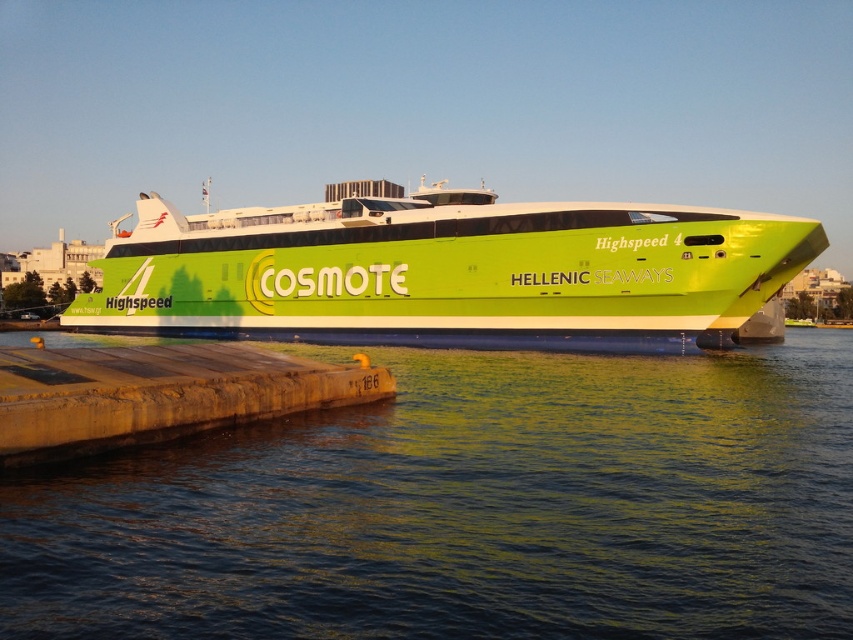
This screenshot has width=853, height=640. Describe the element at coordinates (469, 508) in the screenshot. I see `green reflective water at lower center` at that location.

Is point (131, 460) positioned in front of point (56, 442)?

No.

Is point (741, 484) positioned after point (363, 372)?

No, (741, 484) is in front of (363, 372).

The width and height of the screenshot is (853, 640). In order to click on green reflective water at lower center in this screenshot , I will do [469, 508].

Is green reflective water at lower center shorter than green matte/clear glass ferry at center?

Indeed, green reflective water at lower center has a lesser height compared to green matte/clear glass ferry at center.

Describe the element at coordinates (469, 508) in the screenshot. I see `green reflective water at lower center` at that location.

The height and width of the screenshot is (640, 853). In order to click on green reflective water at lower center in this screenshot , I will do `click(469, 508)`.

Is green matte/clear glass ferry at center below wooden dock at lower left?

Actually, green matte/clear glass ferry at center is above wooden dock at lower left.

Is green matte/clear glass ferry at center to the right of wooden dock at lower left from the viewer's perspective?

Incorrect, green matte/clear glass ferry at center is not on the right side of wooden dock at lower left.

Is point (602, 236) positioned in front of point (171, 369)?

No, it is not.

The width and height of the screenshot is (853, 640). Find the location of `green matte/clear glass ferry at center`. green matte/clear glass ferry at center is located at coordinates (450, 272).